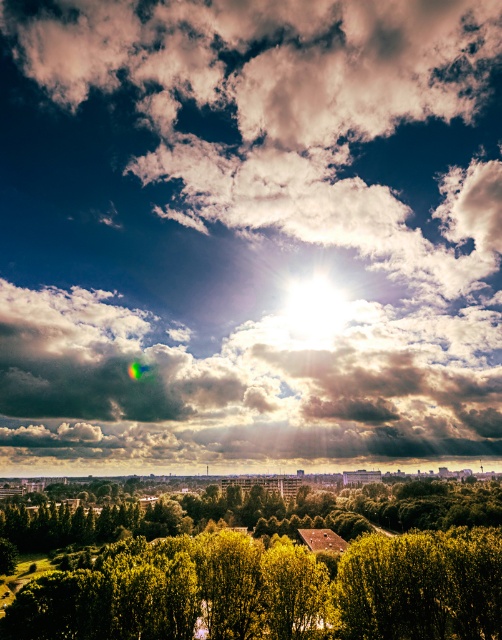
Does bright white clouds at upper center have a lesser height compared to green leafy tree at center?

Incorrect, bright white clouds at upper center's height does not fall short of green leafy tree at center's.

Which is in front, point (176, 108) or point (233, 525)?

Positioned in front is point (233, 525).

Between point (111, 92) and point (70, 604), which one is positioned in front?

Point (70, 604) is in front.

Locate an element on the screen. bright white clouds at upper center is located at coordinates (249, 232).